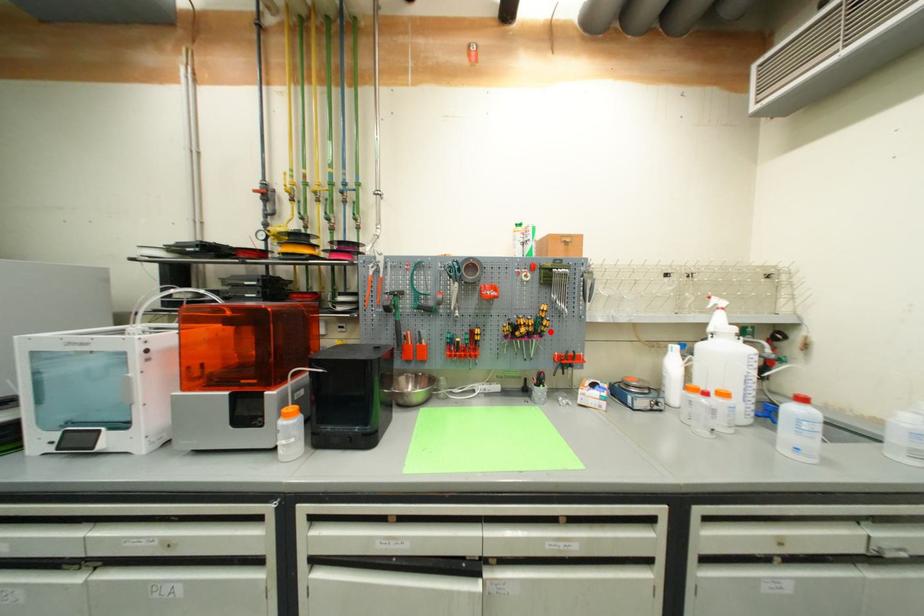
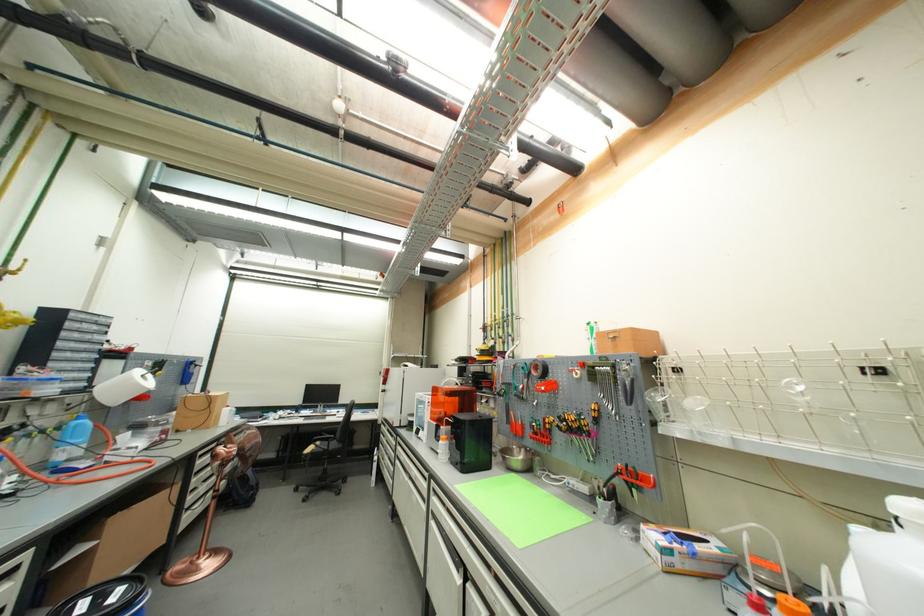
Question: I am providing you with two images of the same scene from different viewpoints. A red point is marked on the first image. At the location where the point appears in image 1, is it still visible in image 2?

Choices:
 (A) Yes
 (B) No

Answer: (A)